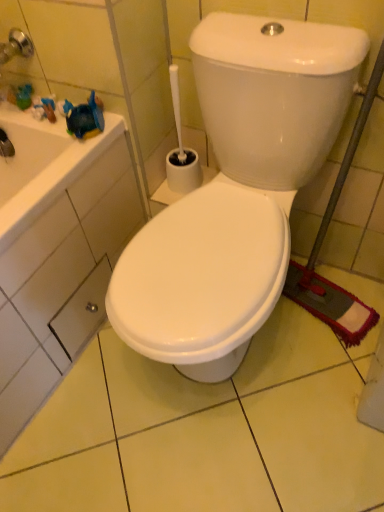
Question: From the image's perspective, does metallic silver drawer at lower left appear higher than white glossy toilet at center?

Choices:
 (A) no
 (B) yes

Answer: (A)

Question: Does metallic silver drawer at lower left have a greater height compared to white glossy toilet at center?

Choices:
 (A) yes
 (B) no

Answer: (B)

Question: Is metallic silver drawer at lower left further to the viewer compared to white glossy toilet at center?

Choices:
 (A) yes
 (B) no

Answer: (A)

Question: Does metallic silver drawer at lower left appear on the left side of white glossy toilet at center?

Choices:
 (A) no
 (B) yes

Answer: (B)

Question: From a real-world perspective, is metallic silver drawer at lower left physically below white glossy toilet at center?

Choices:
 (A) yes
 (B) no

Answer: (A)

Question: Is metallic silver drawer at lower left closer to camera compared to white glossy toilet at center?

Choices:
 (A) yes
 (B) no

Answer: (B)

Question: Is white glossy toilet at center wider than metallic silver drawer at lower left?

Choices:
 (A) yes
 (B) no

Answer: (A)

Question: From the image's perspective, is white glossy toilet at center on metallic silver drawer at lower left?

Choices:
 (A) yes
 (B) no

Answer: (A)

Question: From the image's perspective, is white glossy toilet at center located beneath metallic silver drawer at lower left?

Choices:
 (A) yes
 (B) no

Answer: (B)

Question: Can you confirm if white glossy toilet at center is shorter than metallic silver drawer at lower left?

Choices:
 (A) no
 (B) yes

Answer: (A)

Question: Would you say metallic silver drawer at lower left is part of white glossy toilet at center's contents?

Choices:
 (A) no
 (B) yes

Answer: (A)

Question: Considering the relative positions of white glossy toilet at center and metallic silver drawer at lower left in the image provided, is white glossy toilet at center to the left of metallic silver drawer at lower left from the viewer's perspective?

Choices:
 (A) yes
 (B) no

Answer: (B)

Question: Relative to white glossy toilet at center, is metallic silver drawer at lower left in front or behind?

Choices:
 (A) front
 (B) behind

Answer: (B)